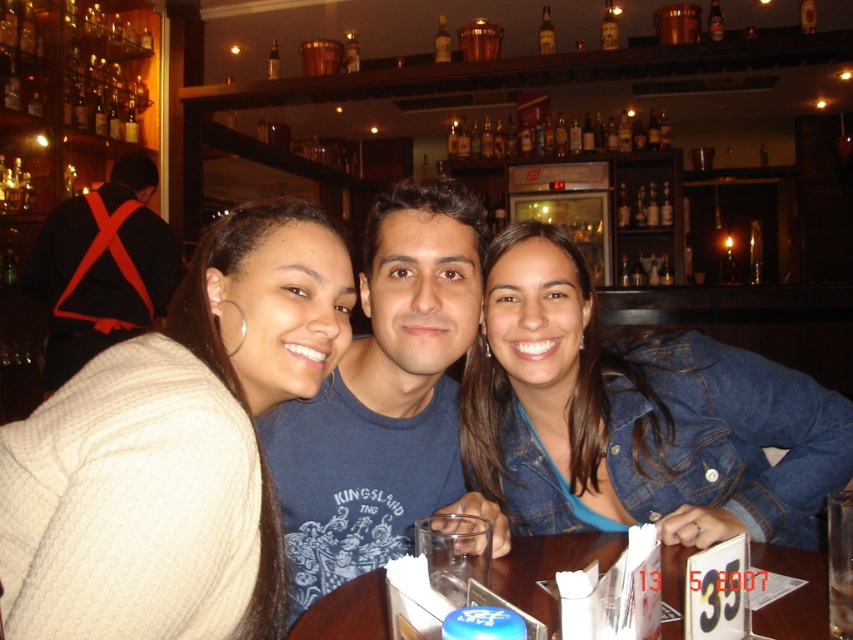
Can you confirm if blue cotton shirt at center is shorter than black leather backpack at upper left?

Yes, blue cotton shirt at center is shorter than black leather backpack at upper left.

Based on the photo, does blue cotton shirt at center have a lesser width compared to black leather backpack at upper left?

In fact, blue cotton shirt at center might be wider than black leather backpack at upper left.

Between point (335, 522) and point (97, 344), which one is positioned in front?

Point (335, 522) is in front.

What are the coordinates of `blue cotton shirt at center` in the screenshot? It's located at (705, 435).

This screenshot has height=640, width=853. Describe the element at coordinates (548, 566) in the screenshot. I see `clear plastic glass at center` at that location.

Can you confirm if clear plastic glass at center is positioned below clear glass at center?

Indeed, clear plastic glass at center is positioned under clear glass at center.

Image resolution: width=853 pixels, height=640 pixels. Describe the element at coordinates (548, 566) in the screenshot. I see `clear plastic glass at center` at that location.

Find the location of a particular element. The height and width of the screenshot is (640, 853). clear plastic glass at center is located at coordinates (548, 566).

Looking at this image, which is below, blue cotton t-shirt at center or translucent glass cup at center?

blue cotton t-shirt at center is below.

Is blue cotton t-shirt at center below translucent glass cup at center?

Yes.

Between point (296, 554) and point (274, 49), which one is positioned in front?

Point (296, 554) is more forward.

The width and height of the screenshot is (853, 640). In order to click on blue cotton t-shirt at center in this screenshot , I will do `click(386, 400)`.